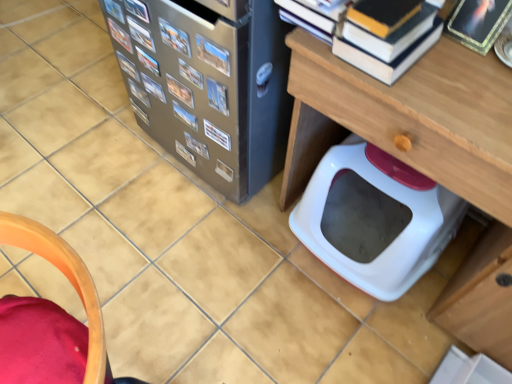
Locate an element on the screen. vacant space situated on the left part of wooden table at lower right is located at coordinates (225, 276).